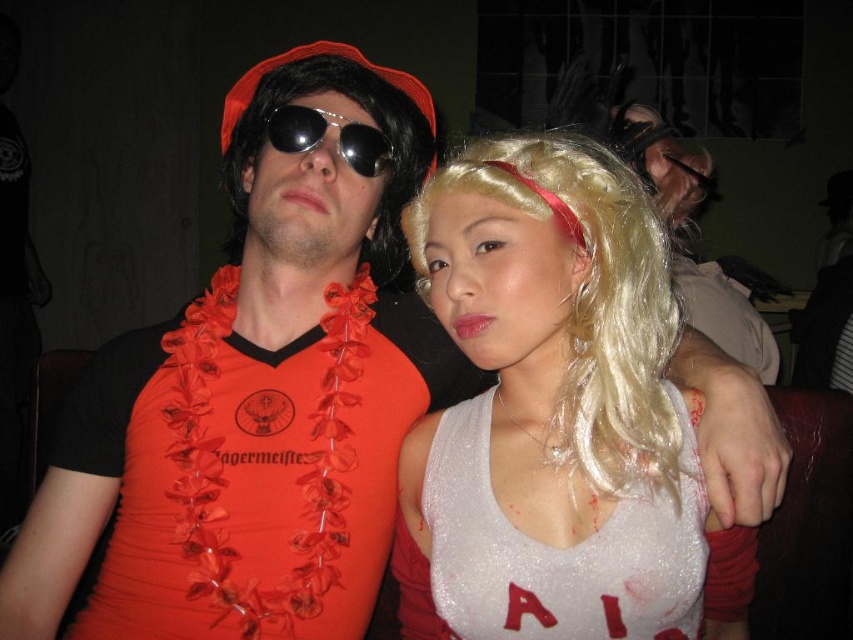
Question: Is shiny white tank top at center positioned behind metallic aviator sunglasses at center?

Choices:
 (A) yes
 (B) no

Answer: (B)

Question: Which object is the closest to the shiny white tank top at center?

Choices:
 (A) matte black wig at upper right
 (B) orange fabric lei at left
 (C) metallic aviator sunglasses at center

Answer: (B)

Question: Does shiny white tank top at center come in front of matte black wig at upper right?

Choices:
 (A) no
 (B) yes

Answer: (B)

Question: Which of these objects is positioned closest to the shiny white tank top at center?

Choices:
 (A) metallic aviator sunglasses at center
 (B) orange fabric lei at left

Answer: (B)

Question: Estimate the real-world distances between objects in this image. Which object is closer to the shiny white tank top at center?

Choices:
 (A) matte black wig at upper right
 (B) metallic aviator sunglasses at center
 (C) orange fabric lei at left

Answer: (C)

Question: Is orange fabric lei at left further to the viewer compared to metallic aviator sunglasses at center?

Choices:
 (A) yes
 (B) no

Answer: (B)